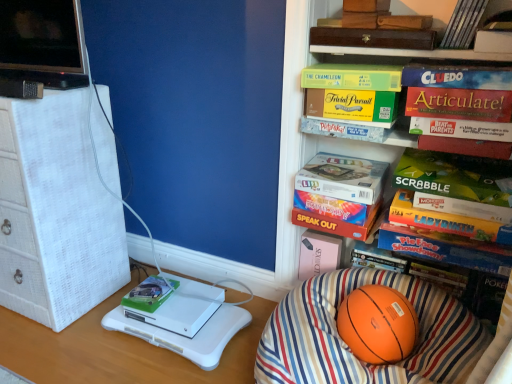
Question: Is hardcover book at center, the twelfth paperback book positioned from the top, to the right of green matte book at lower left, which is the 1th book from bottom to top, from the viewer's perspective?

Choices:
 (A) yes
 (B) no

Answer: (A)

Question: Are hardcover book at center, the twelfth paperback book positioned from the top, and green matte book at lower left, which is the fourth book in right-to-left order, located far from each other?

Choices:
 (A) no
 (B) yes

Answer: (A)

Question: Does hardcover book at center, the twelfth paperback book positioned from the top, have a larger size compared to green matte book at lower left, placed as the first book when sorted from left to right?

Choices:
 (A) yes
 (B) no

Answer: (A)

Question: Does hardcover book at center, which is the first paperback book from bottom to top, contain green matte book at lower left, which is the fourth book in right-to-left order?

Choices:
 (A) no
 (B) yes

Answer: (A)

Question: From the image's perspective, is hardcover book at center, the twelfth paperback book positioned from the top, located above green matte book at lower left, which is the fourth book in right-to-left order?

Choices:
 (A) yes
 (B) no

Answer: (A)

Question: Is hardcover book at center, the twelfth paperback book positioned from the top, turned away from green matte book at lower left, placed as the first book when sorted from left to right?

Choices:
 (A) no
 (B) yes

Answer: (A)

Question: Is brown leather book at upper center, the twelfth paperback book in the bottom-to-top sequence, turned away from blue cardboard cluedo board game at upper right, the third paperback book from the top?

Choices:
 (A) yes
 (B) no

Answer: (B)

Question: Does brown leather book at upper center, the 1th paperback book positioned from the top, have a lesser width compared to blue cardboard cluedo board game at upper right, the third paperback book from the top?

Choices:
 (A) no
 (B) yes

Answer: (A)

Question: Considering the relative positions of brown leather book at upper center, the twelfth paperback book in the bottom-to-top sequence, and blue cardboard cluedo board game at upper right, the third paperback book from the top, in the image provided, is brown leather book at upper center, the twelfth paperback book in the bottom-to-top sequence, in front of blue cardboard cluedo board game at upper right, the third paperback book from the top,?

Choices:
 (A) no
 (B) yes

Answer: (A)

Question: Does brown leather book at upper center, the 1th paperback book positioned from the top, have a greater width compared to blue cardboard cluedo board game at upper right, the third paperback book from the top?

Choices:
 (A) yes
 (B) no

Answer: (A)

Question: Is brown leather book at upper center, the 1th paperback book positioned from the top, positioned far away from blue cardboard cluedo board game at upper right, the third paperback book from the top?

Choices:
 (A) yes
 (B) no

Answer: (B)

Question: From the image's perspective, is brown leather book at upper center, the 1th paperback book positioned from the top, over blue cardboard cluedo board game at upper right, the tenth paperback book from the bottom?

Choices:
 (A) no
 (B) yes

Answer: (B)

Question: Would you say hardcover book at center, which is the first paperback book from bottom to top, is a long distance from green matte board game at upper center, the eleventh paperback book from the bottom?

Choices:
 (A) yes
 (B) no

Answer: (B)